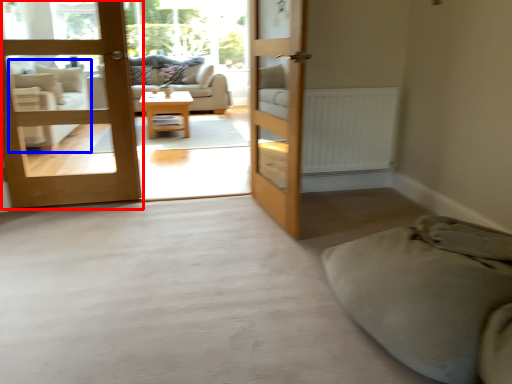
Question: Which of the following is the farthest to the observer, door (highlighted by a red box) or armchair (highlighted by a blue box)?

Choices:
 (A) door
 (B) armchair

Answer: (B)